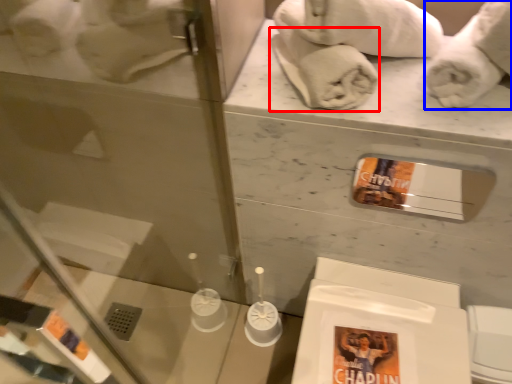
Question: Which object appears closest to the camera in this image, bath towel (highlighted by a red box) or bath towel (highlighted by a blue box)?

Choices:
 (A) bath towel
 (B) bath towel

Answer: (B)